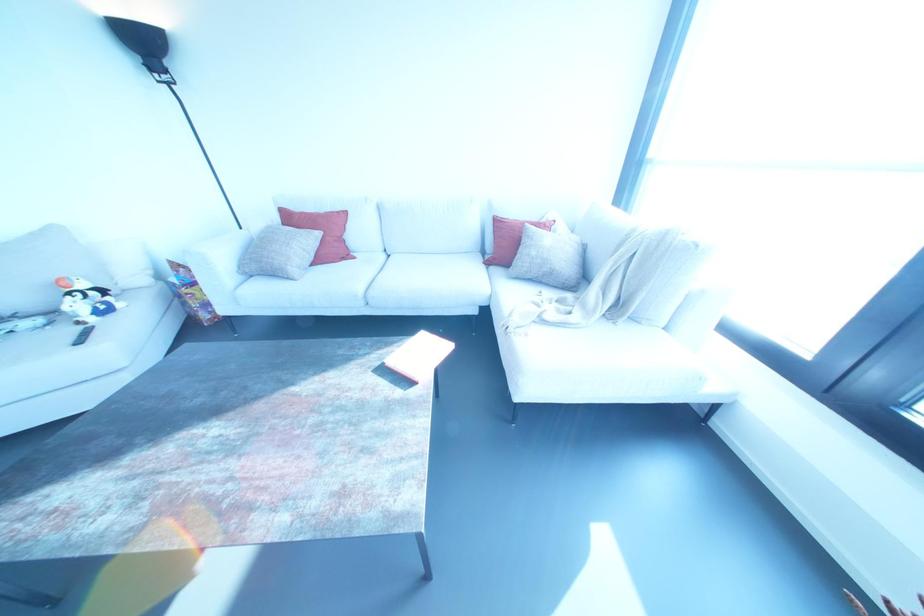
I want to click on sofa sitting surface, so click(x=422, y=268).